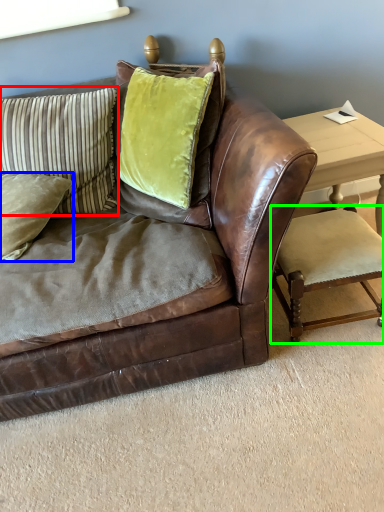
Question: Estimate the real-world distances between objects in this image. Which object is farther from pillow (highlighted by a red box), pillow (highlighted by a blue box) or armchair (highlighted by a green box)?

Choices:
 (A) pillow
 (B) armchair

Answer: (B)